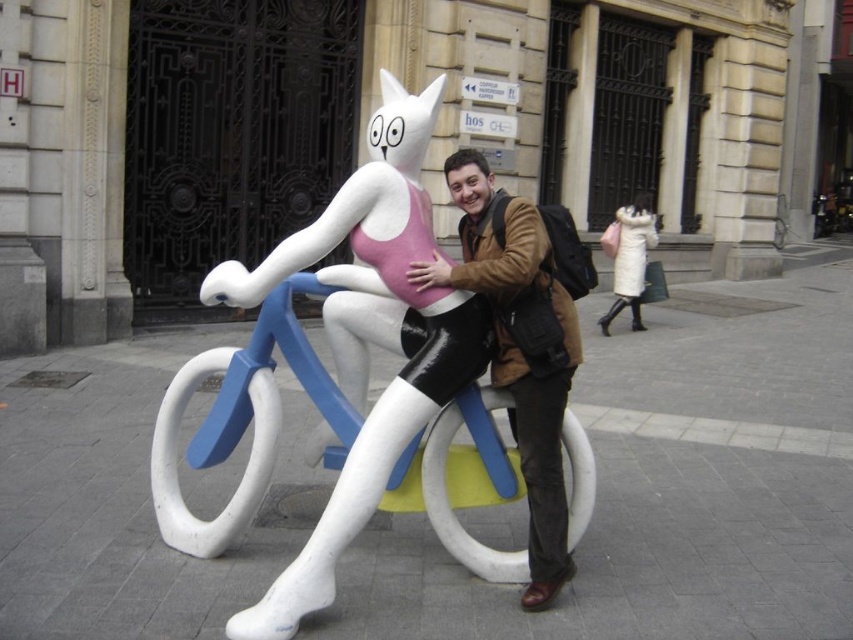
You are a photographer trying to capture a clear shot of the sculpture. You notice the brown leather jacket at center and the white fur coat at upper right might block your view. Which clothing item is taller and could potentially block the sculpture more?

The brown leather jacket at center is taller than the white fur coat at upper right, so it could potentially block the sculpture more.

You are standing at the point with coordinates point (532, 564) and want to walk towards the point with coordinates point (650, 234). Will you pass in front of the sculpture of the cat riding a bicycle?

Yes, because point (532, 564) is in front of point (650, 234), so walking from point (532, 564) to point (650, 234) would mean moving away from the sculpture, so you would not pass in front of it. Wait, this seems contradictory. Let me recheck. The Objects Description says point (532, 564) is in front of point (650, 234). That means if you are at point (532, 564) and move toward (650, 234), you are moving away from the sculpture. Therefore, you would not pass in front of the sculpture. Hmm,